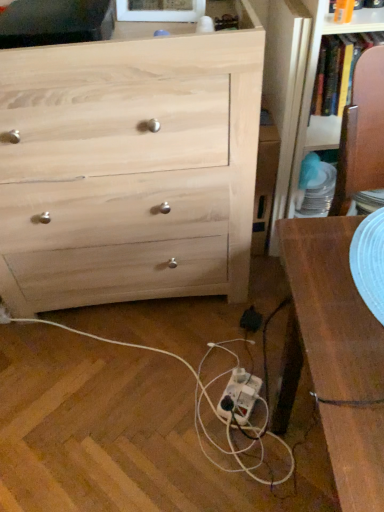
You are a GUI agent. You are given a task and a screenshot of the screen. Output one action in this format:
    pyautogui.click(x=<x>, y=<y>)
    Task: Click on the vacant space that is to the left of white plastic extension cord at lower center
    The width and height of the screenshot is (384, 512).
    Given the screenshot: What is the action you would take?
    pyautogui.click(x=185, y=401)